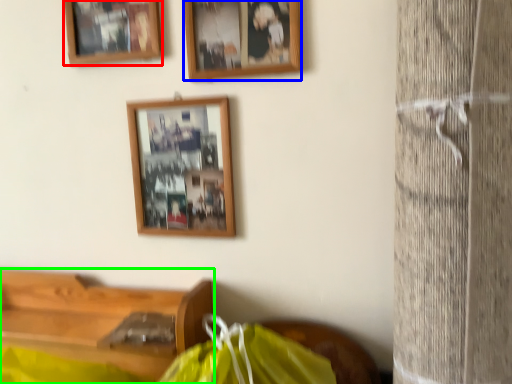
Question: Estimate the real-world distances between objects in this image. Which object is closer to picture frame (highlighted by a red box), picture frame (highlighted by a blue box) or furniture (highlighted by a green box)?

Choices:
 (A) picture frame
 (B) furniture

Answer: (A)